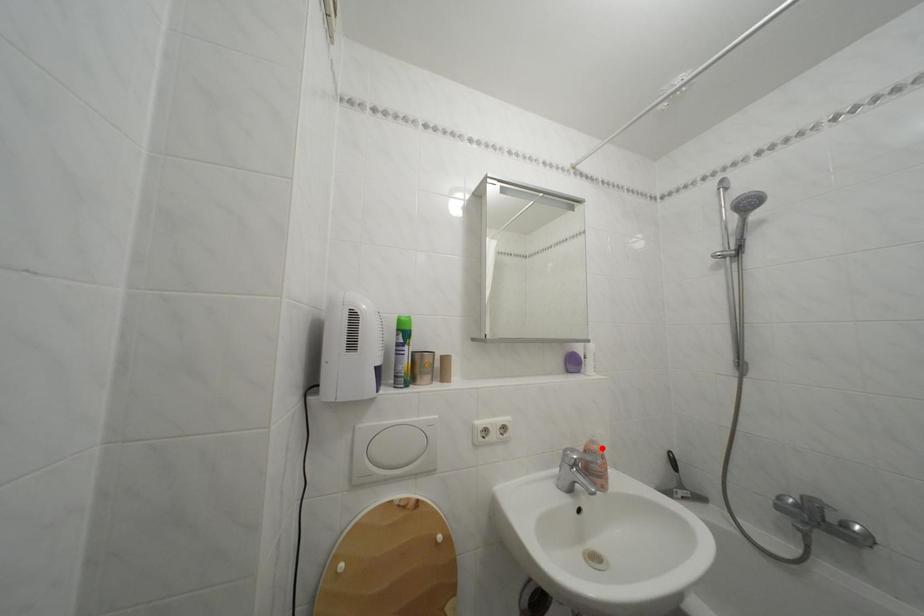
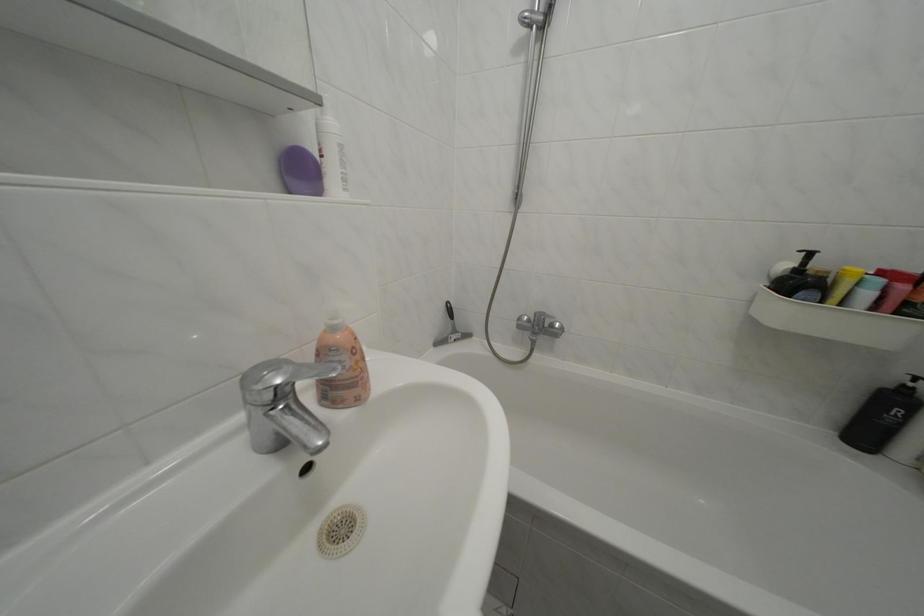
The point at the highlighted location is marked in the first image. Where is the corresponding point in the second image?

(342, 334)